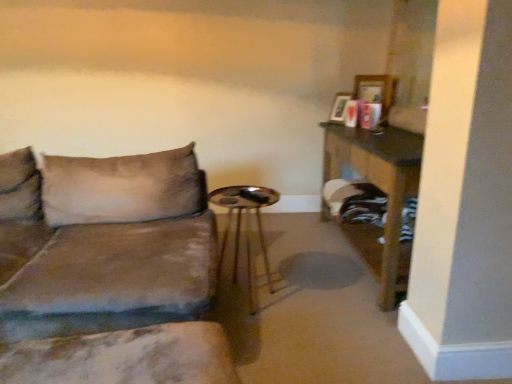
Measure the distance between point (230, 206) and camera.

Point (230, 206) and camera are 3.47 meters apart.

You are a GUI agent. You are given a task and a screenshot of the screen. Output one action in this format:
    pyautogui.click(x=<x>, y=<y>)
    Task: Click on the velvet brown couch at left
    The image size is (512, 384).
    Given the screenshot: What is the action you would take?
    pyautogui.click(x=108, y=271)

What do you see at coordinates (124, 357) in the screenshot? I see `marble-patterned cushion at lower left` at bounding box center [124, 357].

Find the location of `metallic gold side table at center`. metallic gold side table at center is located at coordinates (245, 227).

Based on the photo, would you say velvet brown couch at left is outside marble-patterned cushion at lower left?

Yes, velvet brown couch at left is not within marble-patterned cushion at lower left.

From a real-world perspective, which object rests below the other?

marble-patterned cushion at lower left, from a real-world perspective.

Is the surface of velvet brown couch at left in direct contact with marble-patterned cushion at lower left?

They are not placed beside each other.

Considering the sizes of objects velvet brown couch at left and marble-patterned cushion at lower left in the image provided, who is smaller, velvet brown couch at left or marble-patterned cushion at lower left?

Smaller between the two is marble-patterned cushion at lower left.

Considering the points (399, 240) and (83, 340), which point is behind, point (399, 240) or point (83, 340)?

Positioned behind is point (399, 240).

From a real-world perspective, who is located lower, wooden table at right or marble-patterned cushion at lower left?

In real-world perspective, marble-patterned cushion at lower left is lower.

Is wooden table at right at the left side of marble-patterned cushion at lower left?

In fact, wooden table at right is to the right of marble-patterned cushion at lower left.

Is wooden table at right not near marble-patterned cushion at lower left?

Indeed, wooden table at right is not near marble-patterned cushion at lower left.

Is wooden table at right directly adjacent to metallic gold side table at center?

No, wooden table at right is not with metallic gold side table at center.

Considering the relative positions of wooden table at right and metallic gold side table at center in the image provided, is wooden table at right to the right of metallic gold side table at center from the viewer's perspective?

Indeed, wooden table at right is positioned on the right side of metallic gold side table at center.

Between wooden table at right and metallic gold side table at center, which one is positioned in front?

wooden table at right.

Which point is more distant from viewer, (353, 159) or (269, 275)?

The point (353, 159) is behind.

Is metallic gold side table at center inside or outside of marble-patterned cushion at lower left?

Answer: metallic gold side table at center lies outside marble-patterned cushion at lower left.

Would you consider metallic gold side table at center to be distant from marble-patterned cushion at lower left?

Yes, metallic gold side table at center and marble-patterned cushion at lower left are located far from each other.

From a real-world perspective, does metallic gold side table at center sit lower than marble-patterned cushion at lower left?

No, from a real-world perspective, metallic gold side table at center is not beneath marble-patterned cushion at lower left.

Which point is more forward, [238,204] or [97,380]?

The point [97,380] is in front.

From a real-world perspective, is velvet brown couch at left physically below metallic gold side table at center?

No, from a real-world perspective, velvet brown couch at left is not beneath metallic gold side table at center.

In terms of width, does velvet brown couch at left look wider or thinner when compared to metallic gold side table at center?

velvet brown couch at left is wider than metallic gold side table at center.

Is velvet brown couch at left outside of metallic gold side table at center?

That's correct, velvet brown couch at left is outside of metallic gold side table at center.

From the image's perspective, is metallic gold side table at center beneath velvet brown couch at left?

Yes.

Is metallic gold side table at center far from velvet brown couch at left?

metallic gold side table at center is actually quite close to velvet brown couch at left.

The width and height of the screenshot is (512, 384). Find the location of `side table behind the velvet brown couch at left`. side table behind the velvet brown couch at left is located at coordinates (245, 227).

Considering the sizes of objects marble-patterned cushion at lower left and wooden table at right in the image provided, who is wider, marble-patterned cushion at lower left or wooden table at right?

Wider between the two is marble-patterned cushion at lower left.

Is marble-patterned cushion at lower left in front of or behind wooden table at right in the image?

Visually, marble-patterned cushion at lower left is located in front of wooden table at right.

Is point (209, 360) more distant than point (418, 179)?

No, (209, 360) is closer to viewer.

You are a GUI agent. You are given a task and a screenshot of the screen. Output one action in this format:
    pyautogui.click(x=<x>, y=<y>)
    Task: Click on the swivel chair behind the velvet brown couch at left
    The width and height of the screenshot is (512, 384).
    Given the screenshot: What is the action you would take?
    pyautogui.click(x=124, y=357)

Locate an element on the screen. The width and height of the screenshot is (512, 384). swivel chair located on the left of wooden table at right is located at coordinates (124, 357).

When comparing their distances from velvet brown couch at left, does wooden table at right or metallic gold side table at center seem closer?

Based on the image, metallic gold side table at center appears to be nearer to velvet brown couch at left.

Considering their positions, is wooden table at right positioned further to marble-patterned cushion at lower left than metallic gold side table at center?

wooden table at right lies further to marble-patterned cushion at lower left than the other object.

Estimate the real-world distances between objects in this image. Which object is closer to metallic gold side table at center, wooden table at right or velvet brown couch at left?

The object closer to metallic gold side table at center is velvet brown couch at left.

Estimate the real-world distances between objects in this image. Which object is closer to marble-patterned cushion at lower left, wooden table at right or velvet brown couch at left?

velvet brown couch at left lies closer to marble-patterned cushion at lower left than the other object.

From the image, which object appears to be nearer to velvet brown couch at left, marble-patterned cushion at lower left or wooden table at right?

marble-patterned cushion at lower left lies closer to velvet brown couch at left than the other object.

Looking at the image, which one is located further to wooden table at right, marble-patterned cushion at lower left or velvet brown couch at left?

marble-patterned cushion at lower left lies further to wooden table at right than the other object.

Looking at the image, which one is located further to metallic gold side table at center, marble-patterned cushion at lower left or wooden table at right?

Among the two, marble-patterned cushion at lower left is located further to metallic gold side table at center.

From the image, which object appears to be farther from velvet brown couch at left, marble-patterned cushion at lower left or metallic gold side table at center?

metallic gold side table at center is positioned further to the anchor velvet brown couch at left.

This screenshot has height=384, width=512. In order to click on side table located between marble-patterned cushion at lower left and wooden table at right in the left-right direction in this screenshot , I will do `click(245, 227)`.

The height and width of the screenshot is (384, 512). In order to click on side table between velvet brown couch at left and wooden table at right from left to right in this screenshot , I will do `click(245, 227)`.

Identify the location of swivel chair located between velvet brown couch at left and wooden table at right in the left-right direction. The image size is (512, 384). (124, 357).

Where is `swivel chair between velvet brown couch at left and metallic gold side table at center from front to back`? This screenshot has width=512, height=384. swivel chair between velvet brown couch at left and metallic gold side table at center from front to back is located at coordinates coord(124,357).